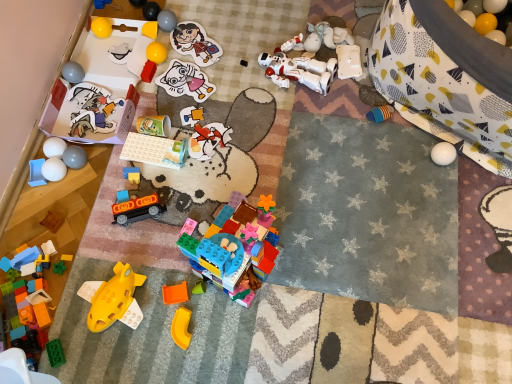
Question: Does white matte eggs at left, placed as the 23th toy when sorted from right to left, appear on the right side of rubber yellow ball at upper left, acting as the 16th toy starting from the right?

Choices:
 (A) yes
 (B) no

Answer: (B)

Question: Is white matte eggs at left, the third toy from the left, completely or partially outside of rubber yellow ball at upper left, acting as the 16th toy starting from the right?

Choices:
 (A) no
 (B) yes

Answer: (B)

Question: Considering the relative positions of white matte eggs at left, placed as the 23th toy when sorted from right to left, and rubber yellow ball at upper left, acting as the 16th toy starting from the right, in the image provided, is white matte eggs at left, placed as the 23th toy when sorted from right to left, to the left of rubber yellow ball at upper left, acting as the 16th toy starting from the right, from the viewer's perspective?

Choices:
 (A) yes
 (B) no

Answer: (A)

Question: Can you confirm if white matte eggs at left, the third toy from the left, is bigger than rubber yellow ball at upper left, acting as the 16th toy starting from the right?

Choices:
 (A) yes
 (B) no

Answer: (A)

Question: Can rubber yellow ball at upper left, positioned as the tenth toy in left-to-right order, be found inside white matte eggs at left, the third toy from the left?

Choices:
 (A) yes
 (B) no

Answer: (B)

Question: Considering the positions of yellow rubber ball at upper right, the 1th toy when ordered from right to left, and matte gray ball at upper center, arranged as the eighth toy when viewed from the right, in the image, is yellow rubber ball at upper right, the 1th toy when ordered from right to left, wider or thinner than matte gray ball at upper center, arranged as the eighth toy when viewed from the right,?

Choices:
 (A) thin
 (B) wide

Answer: (B)

Question: Choose the correct answer: Is yellow rubber ball at upper right, arranged as the 25th toy when viewed from the left, inside matte gray ball at upper center, which is the 18th toy in left-to-right order, or outside it?

Choices:
 (A) inside
 (B) outside

Answer: (B)

Question: From a real-world perspective, is yellow rubber ball at upper right, the 1th toy when ordered from right to left, above or below matte gray ball at upper center, arranged as the eighth toy when viewed from the right?

Choices:
 (A) below
 (B) above

Answer: (B)

Question: From the image's perspective, is yellow rubber ball at upper right, the 1th toy when ordered from right to left, located above or below matte gray ball at upper center, which is the 18th toy in left-to-right order?

Choices:
 (A) below
 (B) above

Answer: (A)

Question: Considering the positions of matte gray ball at upper left, marked as the 21th toy in a right-to-left arrangement, and translucent green plastic toy at lower left, which is the 8th toy in left-to-right order, in the image, is matte gray ball at upper left, marked as the 21th toy in a right-to-left arrangement, bigger or smaller than translucent green plastic toy at lower left, which is the 8th toy in left-to-right order,?

Choices:
 (A) big
 (B) small

Answer: (A)

Question: Which is correct: matte gray ball at upper left, marked as the 21th toy in a right-to-left arrangement, is inside translucent green plastic toy at lower left, the 18th toy from the right, or outside of it?

Choices:
 (A) inside
 (B) outside

Answer: (B)

Question: From the image's perspective, is matte gray ball at upper left, which ranks as the fifth toy in left-to-right order, positioned above or below translucent green plastic toy at lower left, which is the 8th toy in left-to-right order?

Choices:
 (A) below
 (B) above

Answer: (B)

Question: From a real-world perspective, is matte gray ball at upper left, marked as the 21th toy in a right-to-left arrangement, above or below translucent green plastic toy at lower left, the 18th toy from the right?

Choices:
 (A) above
 (B) below

Answer: (A)

Question: Looking at their shapes, would you say white matte balls at left, placed as the 22th toy when sorted from right to left, is wider or thinner than matte gray ball at upper center, which is the 18th toy in left-to-right order?

Choices:
 (A) wide
 (B) thin

Answer: (B)

Question: In terms of height, does white matte balls at left, marked as the 4th toy in a left-to-right arrangement, look taller or shorter compared to matte gray ball at upper center, which is the 18th toy in left-to-right order?

Choices:
 (A) short
 (B) tall

Answer: (A)